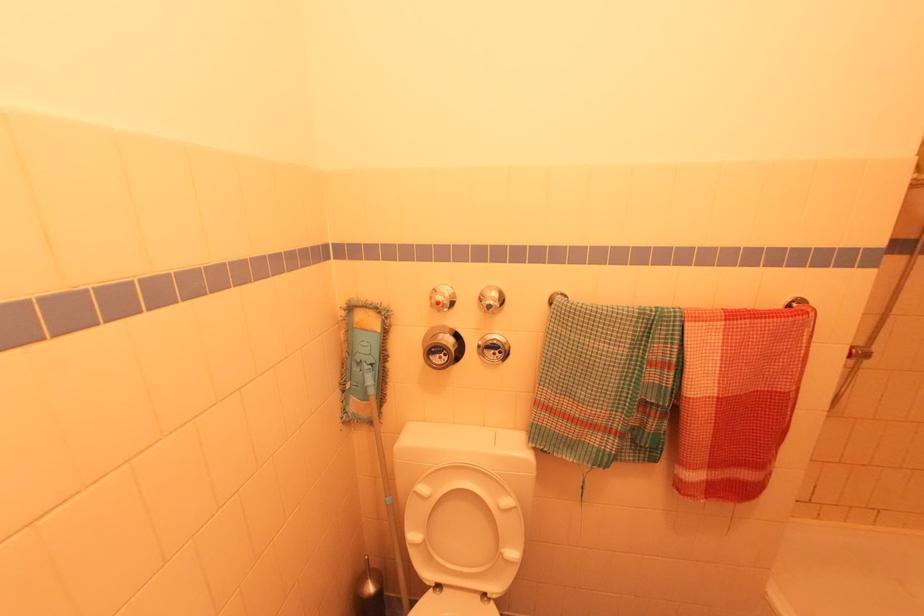
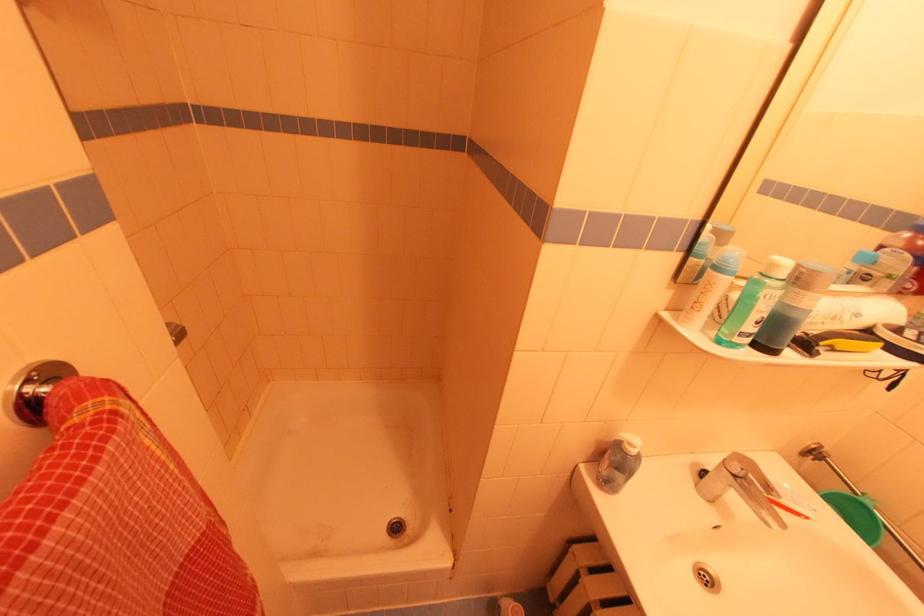
Based on the continuous images, in which direction is the camera rotating?

The camera rotated toward right-down.